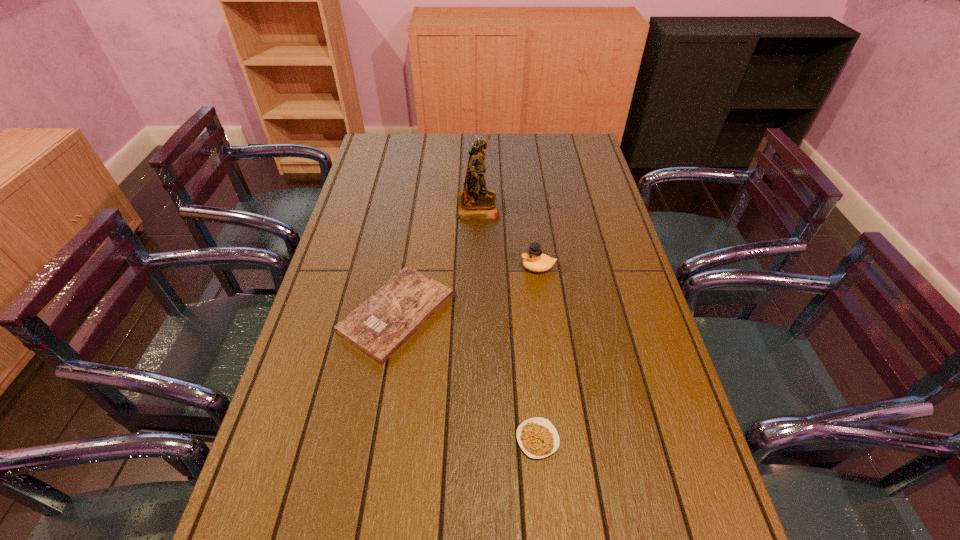
Where is `free space that satisfies the following two spatial constraints: 1. on the front-facing side of the tallest object; 2. on the left side of the legume`? The width and height of the screenshot is (960, 540). free space that satisfies the following two spatial constraints: 1. on the front-facing side of the tallest object; 2. on the left side of the legume is located at coordinates (477, 439).

The width and height of the screenshot is (960, 540). I want to click on vacant area in the image that satisfies the following two spatial constraints: 1. on the front-facing side of the shortest object; 2. on the left side of the farthest object, so click(x=477, y=439).

Where is `vacant space that satisfies the following two spatial constraints: 1. on the front-facing side of the duck; 2. on the front side of the Bible`? This screenshot has height=540, width=960. vacant space that satisfies the following two spatial constraints: 1. on the front-facing side of the duck; 2. on the front side of the Bible is located at coordinates (544, 313).

Where is `free space that satisfies the following two spatial constraints: 1. on the front-facing side of the duck; 2. on the front side of the Bible`? free space that satisfies the following two spatial constraints: 1. on the front-facing side of the duck; 2. on the front side of the Bible is located at coordinates (544, 313).